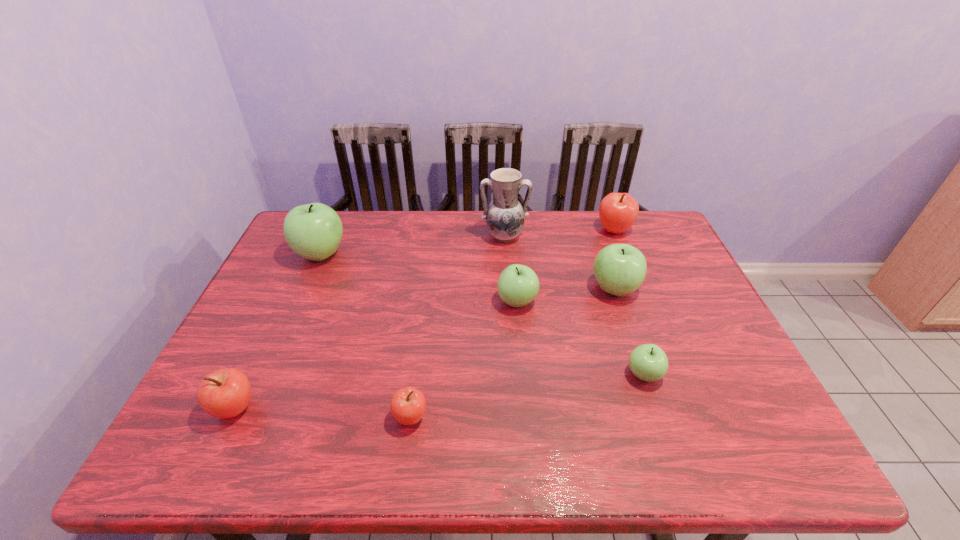
Locate an element on the screen. pottery that is at the far edge is located at coordinates (505, 216).

You are a GUI agent. You are given a task and a screenshot of the screen. Output one action in this format:
    pyautogui.click(x=<x>, y=<y>)
    Task: Click on the object located in the right edge section of the desktop
    This screenshot has height=540, width=960.
    Given the screenshot: What is the action you would take?
    pyautogui.click(x=618, y=211)

Locate an element on the screen. The height and width of the screenshot is (540, 960). object at the far left corner is located at coordinates (313, 231).

What are the coordinates of `object situated at the near left corner` in the screenshot? It's located at (225, 393).

I want to click on object situated at the far right corner, so click(618, 211).

The height and width of the screenshot is (540, 960). Identify the location of vacant space at the far edge of the desktop. (433, 252).

At what (x,y) coordinates should I click in order to perform the action: click on free location at the near edge. Please return your answer as a coordinate pair (x, y). The width and height of the screenshot is (960, 540). Looking at the image, I should click on (497, 454).

The width and height of the screenshot is (960, 540). I want to click on free space at the left edge, so click(284, 282).

Identify the location of vacant space at the right edge of the desktop. The width and height of the screenshot is (960, 540). (647, 287).

I want to click on vacant space at the far right corner, so click(x=643, y=239).